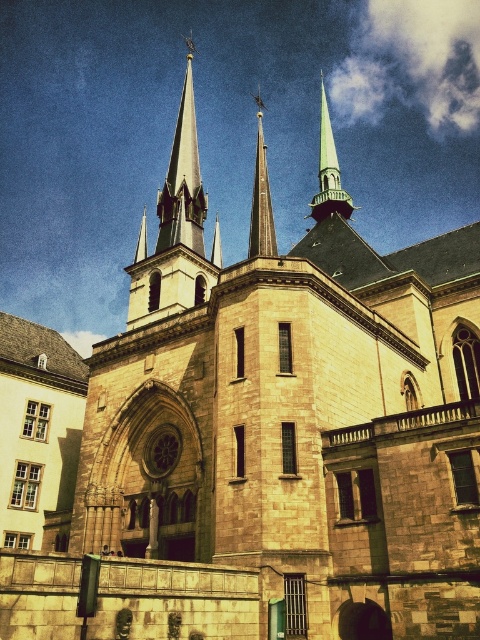
You are standing in front of the historic church and want to take a photo of the spires. The smooth gray spire at upper center and the smooth gray spire at center are both in your view. Which spire should you focus on first if you want to capture the one closer to you?

The smooth gray spire at upper center is closer to you, so you should focus on it first.

You are standing in front of the historic church and want to take a photo of both the smooth gray spire at upper center and the shiny silver spire at upper center. Which spire should you position to your left to capture both in the frame?

You should position the smooth gray spire at upper center to your left since it is already to the left of the shiny silver spire at upper center in the scene.